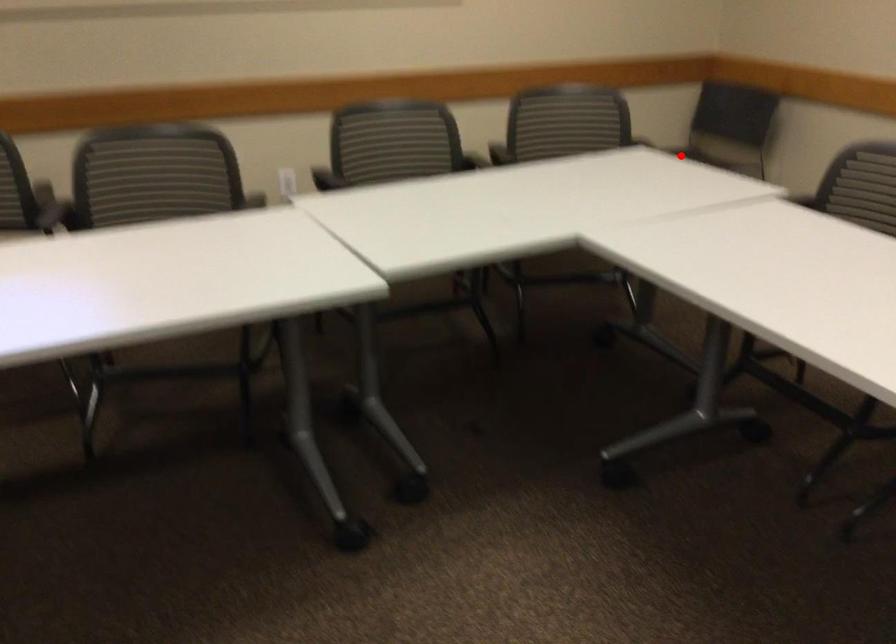
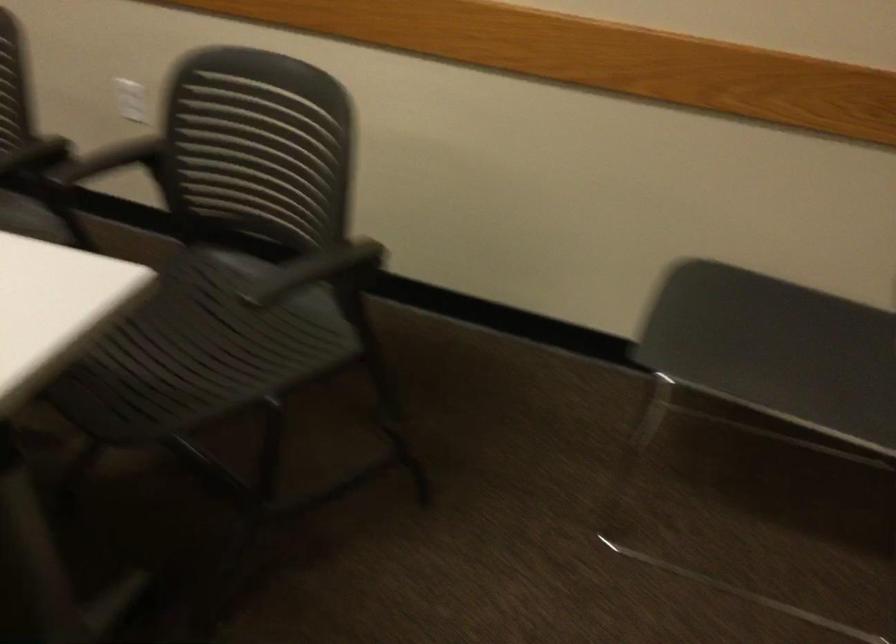
Where in the second image is the point corresponding to the highlighted location from the first image?

(714, 323)